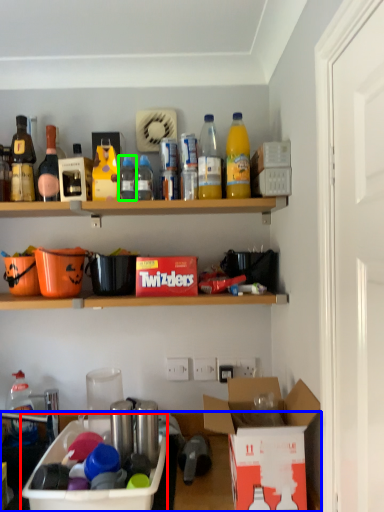
Question: Which is farther away from box (highlighted by a red box)? desk (highlighted by a blue box) or bottle (highlighted by a green box)?

Choices:
 (A) desk
 (B) bottle

Answer: (B)